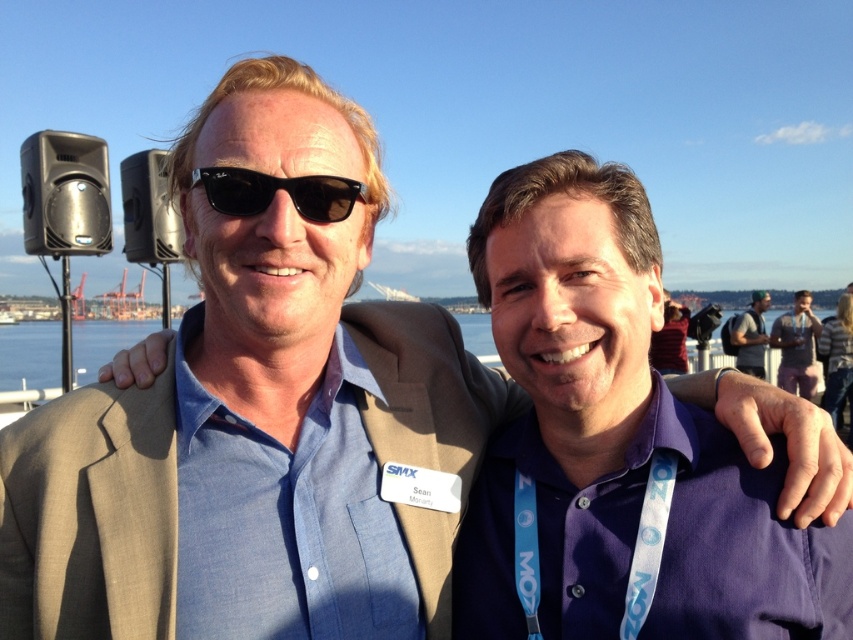
You are a photographer trying to capture a clear photo of the pink fabric at center. However, the black plastic sunglasses at center is blocking your view. Can you determine if the sunglasses are in front of or behind the fabric?

The black plastic sunglasses at center is in front of the pink fabric at center, so it is blocking your view.

You are a photographer trying to capture a photo of the purple cotton shirt at center and the pink fabric at center. Since you want to highlight both items equally, which one should you zoom in on more to make them appear the same size in the final image?

Since the purple cotton shirt at center occupies less space than pink fabric at center, you should zoom in more on the purple cotton shirt at center to make it appear larger in the photo, balancing its size with the pink fabric at center.